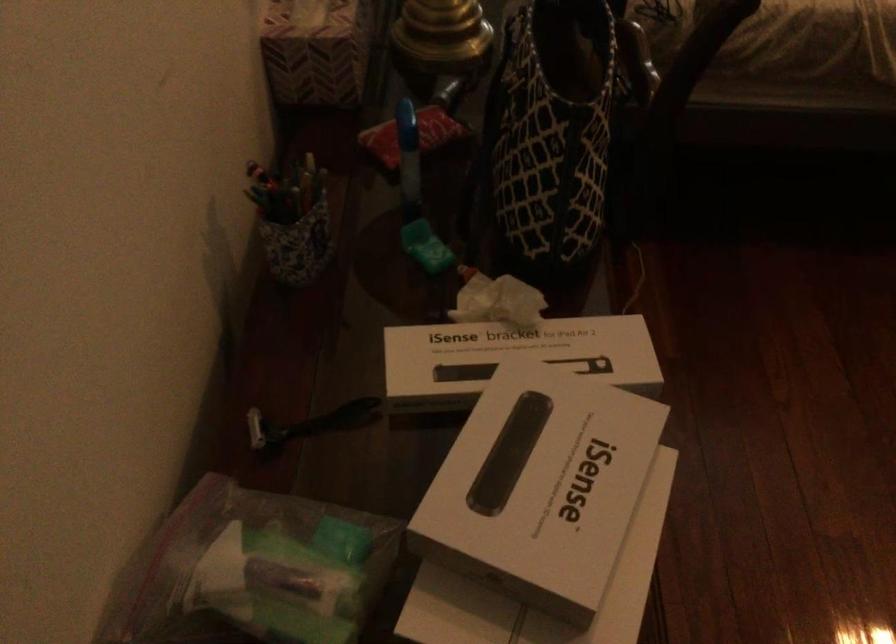
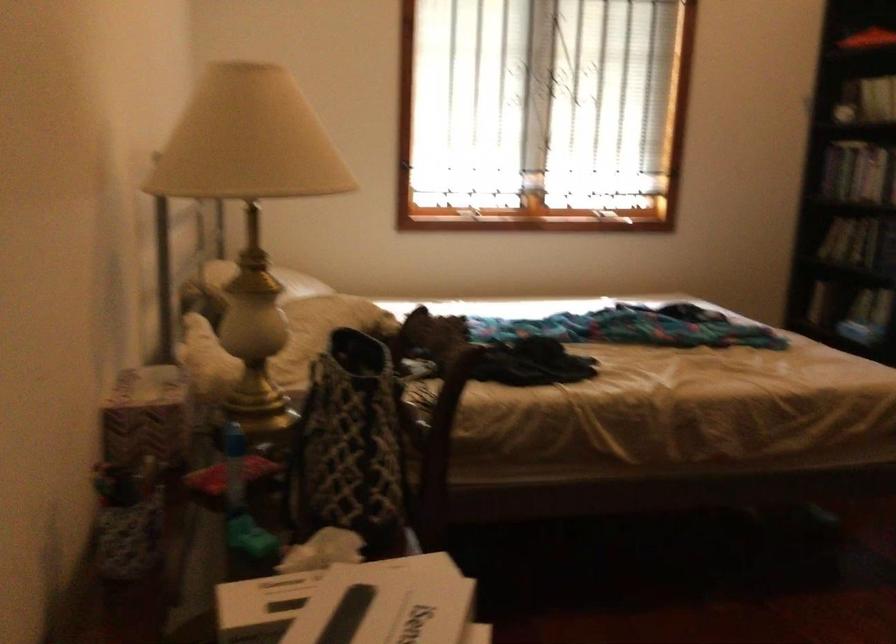
First-person continuous shooting, in which direction is the camera rotating?

The camera rotated toward right-up.